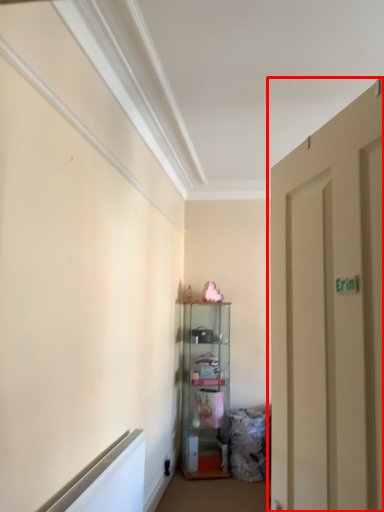
Question: From the image's perspective, considering the relative positions of door (annotated by the red box) and cabinetry in the image provided, where is door (annotated by the red box) located with respect to the staircase?

Choices:
 (A) above
 (B) below

Answer: (A)